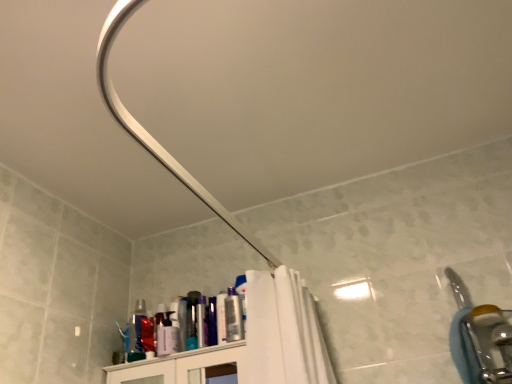
Question: From a real-world perspective, is silver metallic faucet at right above or below metallic silver can at upper center, the 1th toiletry when ordered from left to right?

Choices:
 (A) below
 (B) above

Answer: (A)

Question: Considering their positions, is silver metallic faucet at right located in front of or behind metallic silver can at upper center, the 2th toiletry in the right-to-left sequence?

Choices:
 (A) front
 (B) behind

Answer: (A)

Question: Based on their relative distances, which object is farther from the matte plastic can at upper center, marked as the first toiletry in a right-to-left arrangement?

Choices:
 (A) silver metallic faucet at right
 (B) metallic silver can at upper center, the 2th toiletry in the right-to-left sequence

Answer: (A)

Question: Estimate the real-world distances between objects in this image. Which object is farther from the matte plastic can at upper center, positioned as the second toiletry in left-to-right order?

Choices:
 (A) silver metallic faucet at right
 (B) metallic silver can at upper center, the 1th toiletry when ordered from left to right

Answer: (A)